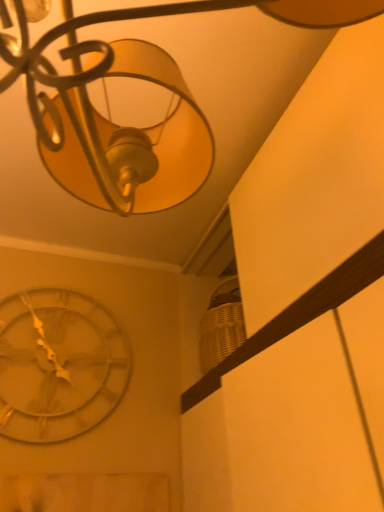
The width and height of the screenshot is (384, 512). I want to click on metallic gold lampshade at upper center, so click(x=142, y=77).

What do you see at coordinates (142, 77) in the screenshot?
I see `metallic gold lampshade at upper center` at bounding box center [142, 77].

Locate an element on the screen. Image resolution: width=384 pixels, height=512 pixels. metallic silver clock at lower left is located at coordinates (x=59, y=365).

The height and width of the screenshot is (512, 384). Describe the element at coordinates (59, 365) in the screenshot. I see `metallic silver clock at lower left` at that location.

Locate an element on the screen. Image resolution: width=384 pixels, height=512 pixels. metallic gold lampshade at upper center is located at coordinates (142, 77).

Can you confirm if metallic silver clock at lower left is positioned to the left of metallic gold lampshade at upper center?

Yes, metallic silver clock at lower left is to the left of metallic gold lampshade at upper center.

Which object is more forward, metallic silver clock at lower left or metallic gold lampshade at upper center?

metallic gold lampshade at upper center is in front.

Does point (39, 368) come farther from viewer compared to point (83, 140)?

Yes, it is.

From the image's perspective, is metallic silver clock at lower left located above or below metallic gold lampshade at upper center?

Based on their image positions, metallic silver clock at lower left is located beneath metallic gold lampshade at upper center.

From a real-world perspective, is metallic silver clock at lower left physically located above or below metallic gold lampshade at upper center?

metallic silver clock at lower left is situated lower than metallic gold lampshade at upper center in the real world.

Which object is thinner, metallic silver clock at lower left or metallic gold lampshade at upper center?

With smaller width is metallic silver clock at lower left.

Looking at this image, does metallic silver clock at lower left have a greater height compared to metallic gold lampshade at upper center?

Incorrect, the height of metallic silver clock at lower left is not larger of that of metallic gold lampshade at upper center.

Based on their sizes in the image, would you say metallic silver clock at lower left is bigger or smaller than metallic gold lampshade at upper center?

In the image, metallic silver clock at lower left appears to be smaller than metallic gold lampshade at upper center.

Would you say metallic silver clock at lower left contains metallic gold lampshade at upper center?

Definitely not — metallic gold lampshade at upper center is not inside metallic silver clock at lower left.

Does metallic silver clock at lower left touch metallic gold lampshade at upper center?

No.

Is metallic silver clock at lower left facing towards metallic gold lampshade at upper center?

Yes, metallic silver clock at lower left is facing metallic gold lampshade at upper center.

How many degrees apart are the facing directions of metallic silver clock at lower left and metallic gold lampshade at upper center?

0.856 degrees separate the facing orientations of metallic silver clock at lower left and metallic gold lampshade at upper center.

How much distance is there between metallic silver clock at lower left and metallic gold lampshade at upper center?

metallic silver clock at lower left and metallic gold lampshade at upper center are 89.68 centimeters apart from each other.

At what (x,y) coordinates should I click in order to perform the action: click on wall clock below the metallic gold lampshade at upper center (from a real-world perspective). Please return your answer as a coordinate pair (x, y). The image size is (384, 512). Looking at the image, I should click on (59, 365).

Is metallic gold lampshade at upper center at the right side of metallic silver clock at lower left?

Indeed, metallic gold lampshade at upper center is positioned on the right side of metallic silver clock at lower left.

Which object is more forward, metallic gold lampshade at upper center or metallic silver clock at lower left?

Positioned in front is metallic gold lampshade at upper center.

Considering the points (136, 8) and (36, 320), which point is in front, point (136, 8) or point (36, 320)?

The point (136, 8) is more forward.

From the picture: From the image's perspective, is metallic gold lampshade at upper center over metallic silver clock at lower left?

Yes.

From a real-world perspective, does metallic gold lampshade at upper center stand above metallic silver clock at lower left?

Correct, in the physical world, metallic gold lampshade at upper center is higher than metallic silver clock at lower left.

In the scene shown: Considering the relative sizes of metallic gold lampshade at upper center and metallic silver clock at lower left in the image provided, is metallic gold lampshade at upper center thinner than metallic silver clock at lower left?

No.

Is metallic gold lampshade at upper center taller than metallic silver clock at lower left?

Correct, metallic gold lampshade at upper center is much taller as metallic silver clock at lower left.

From the picture: Can you confirm if metallic gold lampshade at upper center is bigger than metallic silver clock at lower left?

Correct, metallic gold lampshade at upper center is larger in size than metallic silver clock at lower left.

Is metallic gold lampshade at upper center inside or outside of metallic silver clock at lower left?

metallic gold lampshade at upper center lies outside metallic silver clock at lower left.

Are metallic gold lampshade at upper center and metallic silver clock at lower left far apart?

metallic gold lampshade at upper center is near metallic silver clock at lower left, not far away.

Is metallic gold lampshade at upper center facing away from metallic silver clock at lower left?

Yes, metallic gold lampshade at upper center is facing away from metallic silver clock at lower left.

Where is `lamp that appears in front of the metallic silver clock at lower left`? lamp that appears in front of the metallic silver clock at lower left is located at coordinates (142, 77).

What are the coordinates of `lamp in front of the metallic silver clock at lower left` in the screenshot? It's located at [142, 77].

Locate an element on the screen. This screenshot has height=512, width=384. wall clock below the metallic gold lampshade at upper center (from the image's perspective) is located at coordinates (59, 365).